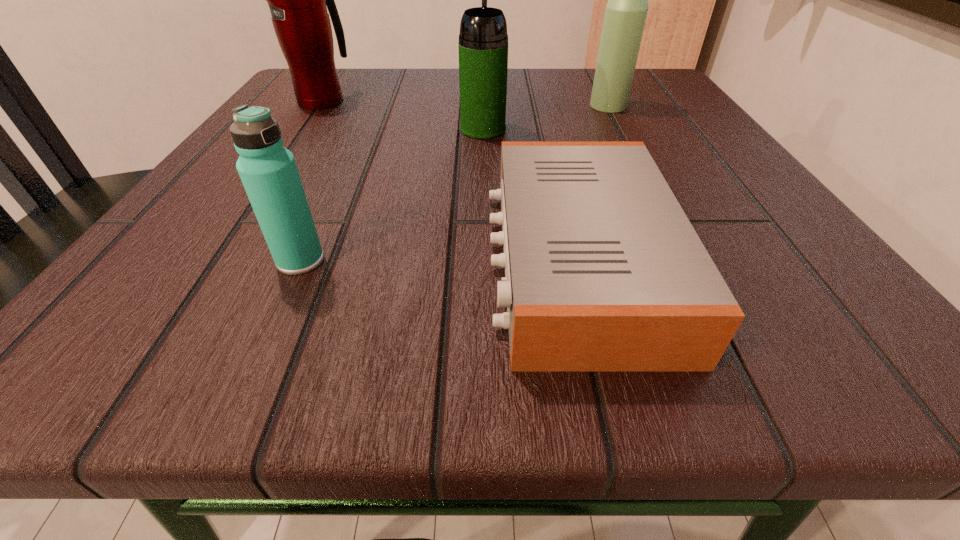
You are a GUI agent. You are given a task and a screenshot of the screen. Output one action in this format:
    pyautogui.click(x=<x>, y=<y>)
    Task: Click on the vacant position located from the spout of the second nearest thermos bottle
    
    Given the screenshot: What is the action you would take?
    pyautogui.click(x=482, y=70)

Locate an element on the screen. The image size is (960, 540). blank area located from the spout of the second nearest thermos bottle is located at coordinates (483, 91).

Find the location of `vacant space located on the right of the shortest thermos bottle`. vacant space located on the right of the shortest thermos bottle is located at coordinates (560, 260).

Find the location of a particular element. free space located 0.200m on the control panel of the shortest object is located at coordinates (308, 261).

You are a GUI agent. You are given a task and a screenshot of the screen. Output one action in this format:
    pyautogui.click(x=<x>, y=<y>)
    Task: Click on the vacant space located on the control panel of the shortest object
    The width and height of the screenshot is (960, 540).
    Given the screenshot: What is the action you would take?
    pyautogui.click(x=272, y=261)

This screenshot has width=960, height=540. I want to click on free spot located on the control panel of the shortest object, so (x=426, y=261).

At what (x,y) coordinates should I click in order to perform the action: click on object present at the near edge. Please return your answer as a coordinate pair (x, y). Image resolution: width=960 pixels, height=540 pixels. Looking at the image, I should click on (603, 270).

In order to click on object situated at the right edge in this screenshot , I will do `click(625, 15)`.

I want to click on object located in the far left corner section of the desktop, so click(297, 0).

This screenshot has height=540, width=960. What are the coordinates of `object situated at the far right corner` in the screenshot? It's located at (625, 15).